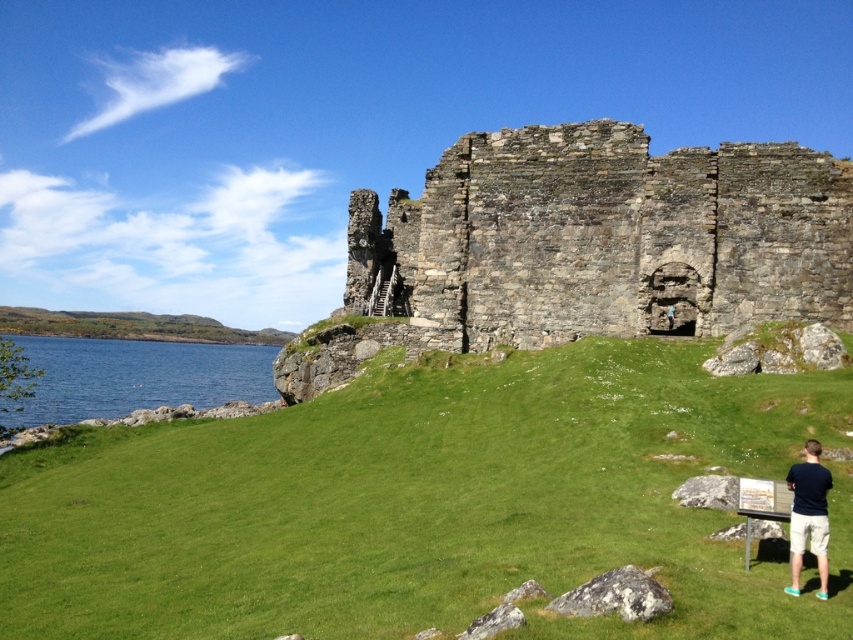
Is blue water at lower left thinner than green grassy hill at left?

Correct, blue water at lower left's width is less than green grassy hill at left's.

Who is more forward, (x=245, y=356) or (x=30, y=321)?

Positioned in front is point (x=245, y=356).

Find the location of a particular element. This screenshot has height=640, width=853. blue water at lower left is located at coordinates (137, 376).

How much distance is there between green grassy at center and blue water at lower left?

382.96 feet

Can you confirm if green grassy at center is positioned to the right of blue water at lower left?

Correct, you'll find green grassy at center to the right of blue water at lower left.

Image resolution: width=853 pixels, height=640 pixels. I want to click on green grassy at center, so click(424, 504).

From the picture: Is green grassy at center positioned before rustic stone castle at center?

Yes.

Which is above, green grassy at center or rustic stone castle at center?

rustic stone castle at center is above.

Does point (456, 524) come in front of point (548, 259)?

Yes, point (456, 524) is closer to viewer.

Locate an element on the screen. The width and height of the screenshot is (853, 640). green grassy at center is located at coordinates (424, 504).